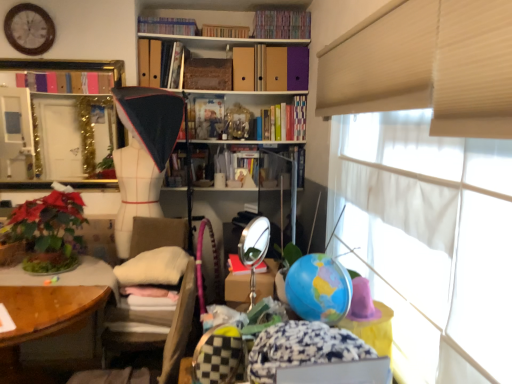
Question: Is green leafy plant at lower left spatially inside white fabric mannequin at center, or outside of it?

Choices:
 (A) inside
 (B) outside

Answer: (B)

Question: Is green leafy plant at lower left taller or shorter than white fabric mannequin at center?

Choices:
 (A) short
 (B) tall

Answer: (A)

Question: Based on their relative distances, which object is farther from the matte plastic book at center, which appears as the 5th book when viewed from the top?

Choices:
 (A) green leafy plant at lower left
 (B) matte cardboard book at upper center, positioned as the fourth book in top-to-bottom order
 (C) wooden at left
 (D) gold metallic mirror at upper left
 (E) white fabric at upper right

Answer: (E)

Question: Based on their relative distances, which object is nearer to the matte cardboard book at upper center, positioned as the fourth book in top-to-bottom order?

Choices:
 (A) hardcover books at upper center, which appears as the sixth book when ordered from the bottom
 (B) hardcover books at upper center, marked as the 1th book in a bottom-to-top arrangement
 (C) wooden clock at upper left
 (D) white fabric mannequin at center
 (E) gold metallic mirror at upper left

Answer: (E)